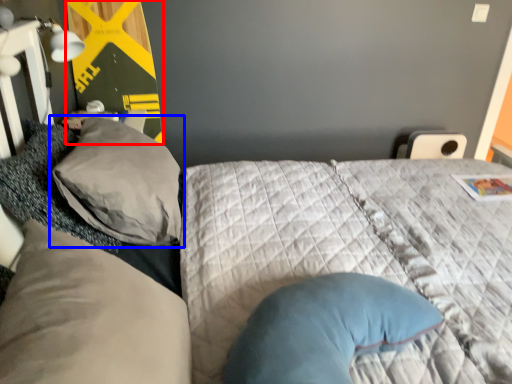
Question: Which object appears farthest to the camera in this image, bulletin board (highlighted by a red box) or pillow (highlighted by a blue box)?

Choices:
 (A) bulletin board
 (B) pillow

Answer: (A)